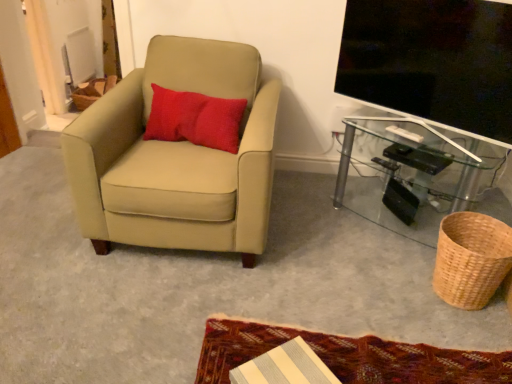
You are a GUI agent. You are given a task and a screenshot of the screen. Output one action in this format:
    pyautogui.click(x=<x>, y=<y>)
    Task: Click on the free space to the left of suede beige armchair at left
    This screenshot has height=384, width=512.
    Given the screenshot: What is the action you would take?
    pyautogui.click(x=37, y=206)